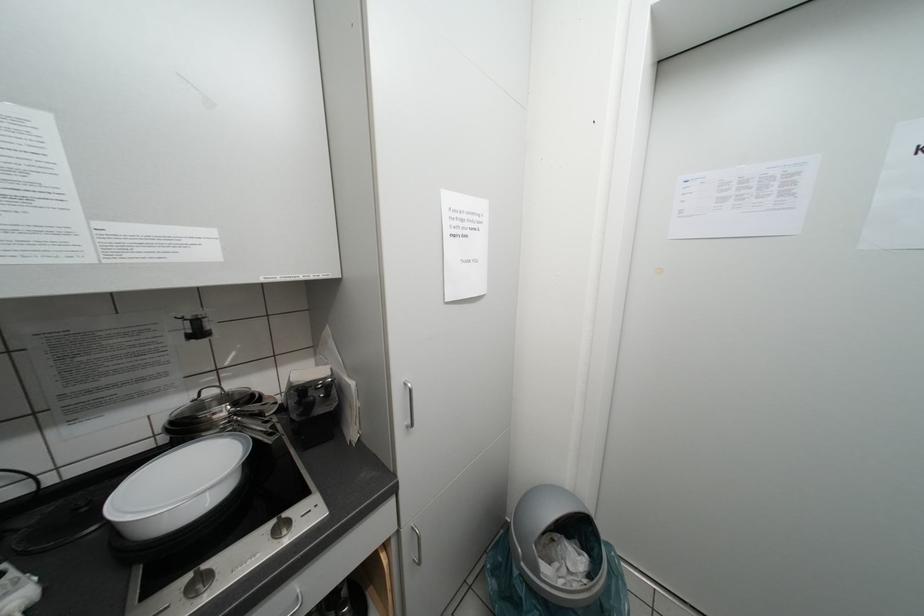
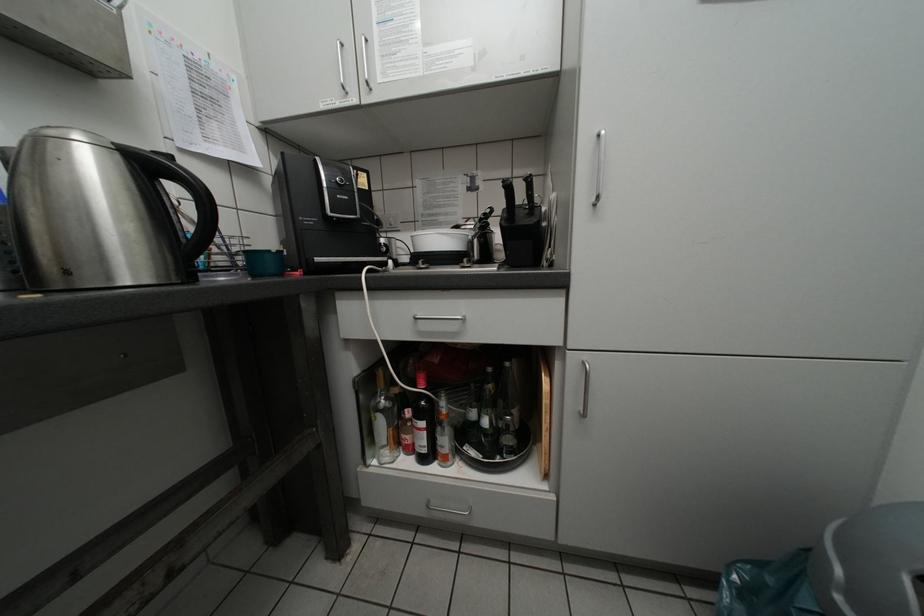
Question: Based on the continuous images, in which direction is the camera rotating? Reply with the corresponding letter.

Choices:
 (A) Left
 (B) Right
 (C) Up
 (D) Down

Answer: (A)